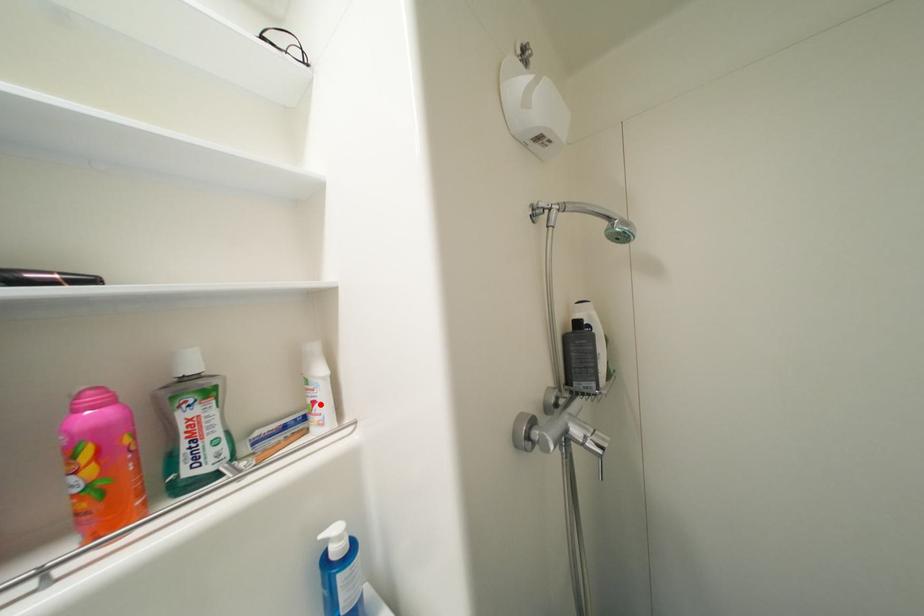
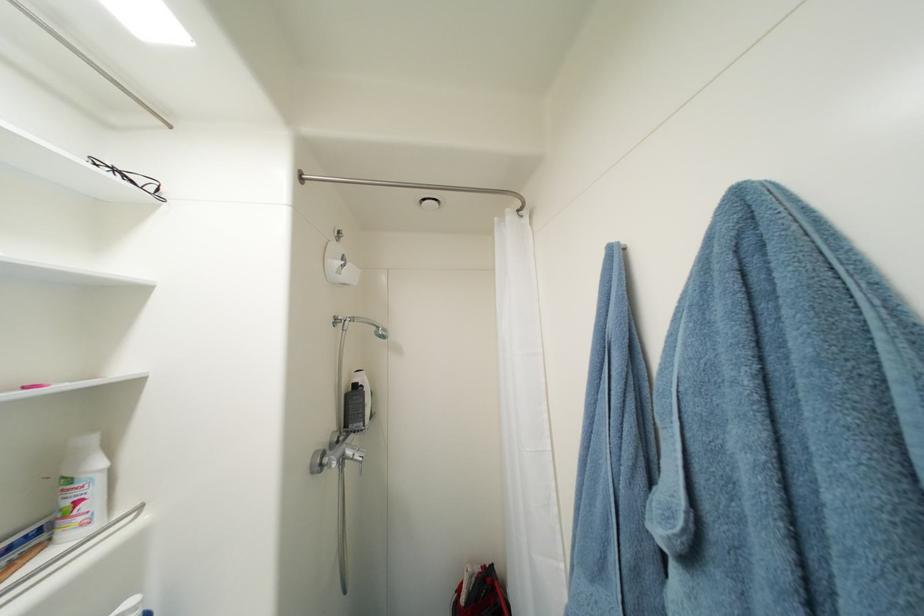
Find the pixel in the second image that matches the highlighted location in the first image.

(84, 504)